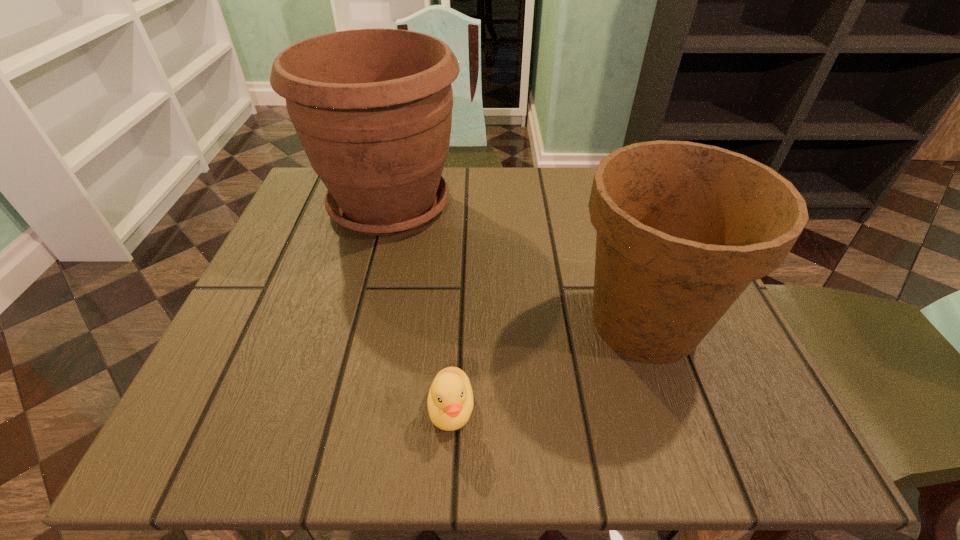
In order to click on the tallest object in this screenshot , I will do `click(372, 108)`.

Identify the location of the left flowerpot. (372, 108).

This screenshot has width=960, height=540. Identify the location of the right flowerpot. (683, 228).

Locate an element on the screen. The height and width of the screenshot is (540, 960). the rightmost object is located at coordinates (683, 228).

You are a GUI agent. You are given a task and a screenshot of the screen. Output one action in this format:
    pyautogui.click(x=<x>, y=<y>)
    Task: Click on the shortest object
    Image resolution: width=960 pixels, height=540 pixels.
    Given the screenshot: What is the action you would take?
    pyautogui.click(x=450, y=402)

The width and height of the screenshot is (960, 540). In order to click on vacant space located on the right of the left flowerpot in this screenshot , I will do `click(596, 205)`.

At what (x,y) coordinates should I click in order to perform the action: click on vacant space situated 0.200m on the left of the shorter flowerpot. Please return your answer as a coordinate pair (x, y). Looking at the image, I should click on (451, 322).

Find the location of `object that is at the far edge`. object that is at the far edge is located at coordinates (372, 108).

I want to click on object that is positioned at the near edge, so [450, 402].

The width and height of the screenshot is (960, 540). What are the coordinates of `object present at the left edge` in the screenshot? It's located at coord(372,108).